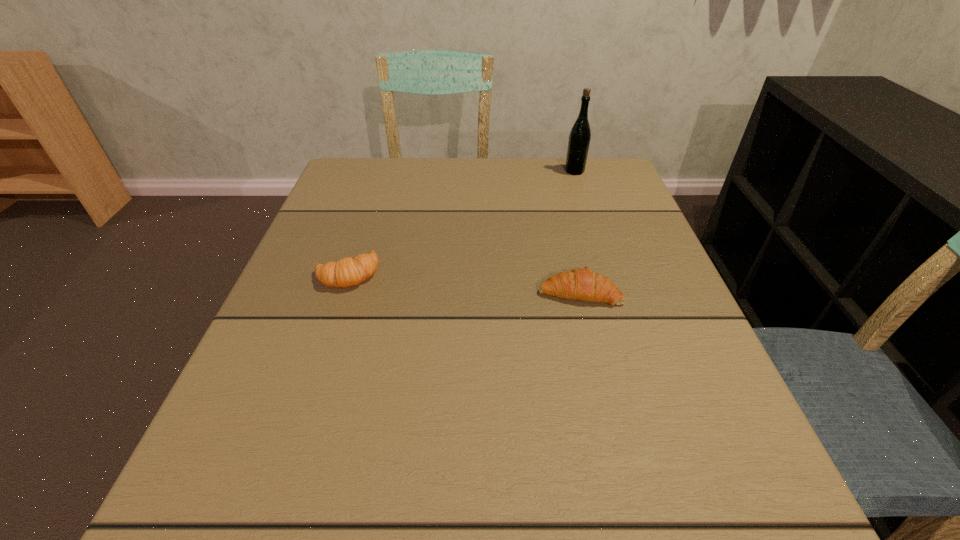
You are a GUI agent. You are given a task and a screenshot of the screen. Output one action in this format:
    pyautogui.click(x=<x>, y=<y>)
    Task: Click on the beer bottle
    
    Given the screenshot: What is the action you would take?
    pyautogui.click(x=579, y=139)

Identify the location of the tallest object. (579, 139).

The height and width of the screenshot is (540, 960). What are the coordinates of `the leftmost object` in the screenshot? It's located at (346, 272).

Where is `the right crescent roll`? the right crescent roll is located at coordinates (583, 284).

At what (x,y) coordinates should I click in order to perform the action: click on free location located on the left of the tallest object. Please return your answer as a coordinate pair (x, y). The height and width of the screenshot is (540, 960). Looking at the image, I should click on pos(526,171).

Find the location of a particular element. Image resolution: width=960 pixels, height=540 pixels. blank space located on the front of the left crescent roll is located at coordinates (300, 417).

This screenshot has width=960, height=540. I want to click on free point located on the front of the right crescent roll, so click(637, 532).

I want to click on object that is at the far edge, so click(579, 139).

Where is `object that is positioned at the left edge`? object that is positioned at the left edge is located at coordinates (346, 272).

Where is `beer bottle situated at the right edge`? Image resolution: width=960 pixels, height=540 pixels. beer bottle situated at the right edge is located at coordinates (579, 139).